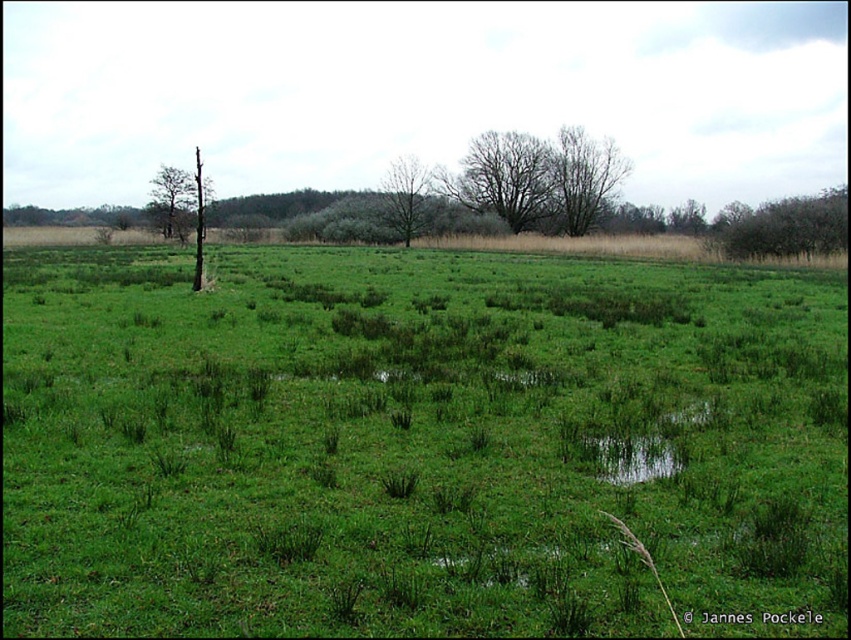
You are an ornithologist observing birds in the grassland. You notice two trees in the distance. The first is a bare branches at upper center, and the second is a green leafy tree at upper left. Which tree is positioned lower in the scene?

The bare branches at upper center is positioned lower than the green leafy tree at upper left.